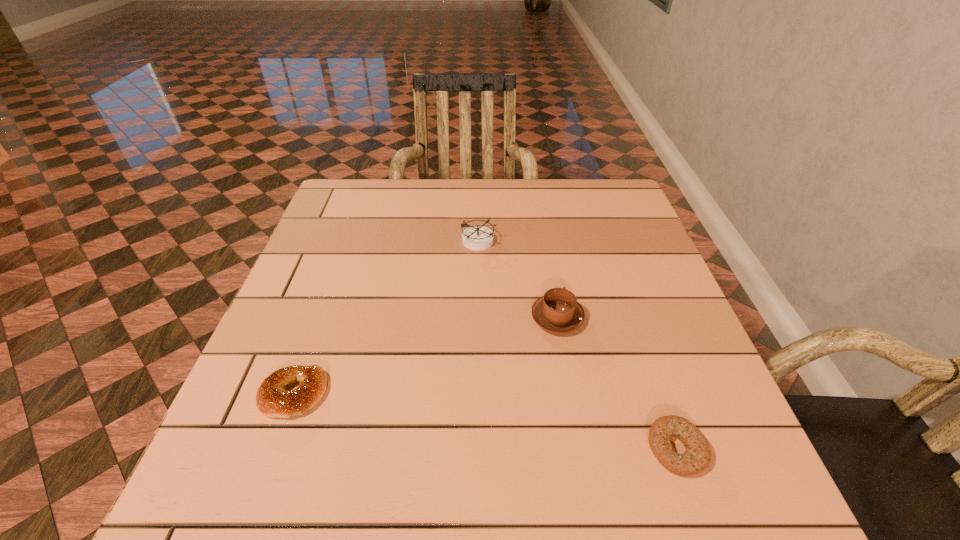
Where is `vacant point located between the right bagel and the third object from right to left`? Image resolution: width=960 pixels, height=540 pixels. vacant point located between the right bagel and the third object from right to left is located at coordinates (578, 345).

You are a GUI agent. You are given a task and a screenshot of the screen. Output one action in this format:
    pyautogui.click(x=<x>, y=<y>)
    Task: Click on the vacant area between the right bagel and the left bagel
    This screenshot has width=960, height=540.
    Given the screenshot: What is the action you would take?
    pyautogui.click(x=485, y=421)

Identify the location of free space between the farthest object and the second farthest object. The image size is (960, 540). click(518, 279).

This screenshot has height=540, width=960. Find the location of `object that stands as the third closest to the farthest object`. object that stands as the third closest to the farthest object is located at coordinates (696, 458).

Find the location of a particular element. This screenshot has width=960, height=540. object that is the second closest to the rightmost object is located at coordinates (477, 238).

Locate an element on the screen. The image size is (960, 540). vacant position in the image that satisfies the following two spatial constraints: 1. on the back side of the leftmost object; 2. on the right side of the farthest object is located at coordinates (349, 241).